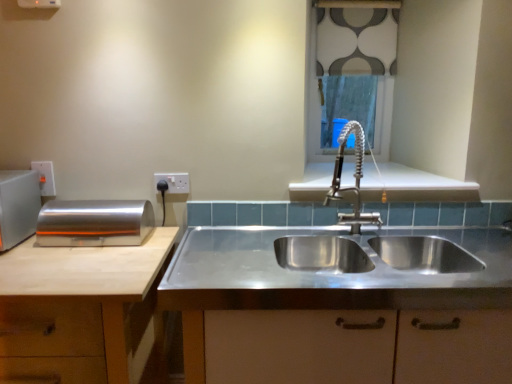
Question: From the image's perspective, is patterned fabric at upper center under stainless steel sink at center?

Choices:
 (A) no
 (B) yes

Answer: (A)

Question: Does patterned fabric at upper center come in front of stainless steel sink at center?

Choices:
 (A) no
 (B) yes

Answer: (A)

Question: Is patterned fabric at upper center bigger than stainless steel sink at center?

Choices:
 (A) no
 (B) yes

Answer: (A)

Question: Considering the relative sizes of patterned fabric at upper center and stainless steel sink at center in the image provided, is patterned fabric at upper center taller than stainless steel sink at center?

Choices:
 (A) no
 (B) yes

Answer: (B)

Question: Does patterned fabric at upper center have a lesser width compared to stainless steel sink at center?

Choices:
 (A) no
 (B) yes

Answer: (B)

Question: From the image's perspective, is stainless steel sink at center located above or below silver metallic breadbox at left, acting as the second appliance starting from the left?

Choices:
 (A) above
 (B) below

Answer: (B)

Question: Is stainless steel sink at center wider or thinner than silver metallic breadbox at left, marked as the first appliance in a right-to-left arrangement?

Choices:
 (A) wide
 (B) thin

Answer: (A)

Question: From a real-world perspective, is stainless steel sink at center physically located above or below silver metallic breadbox at left, marked as the first appliance in a right-to-left arrangement?

Choices:
 (A) below
 (B) above

Answer: (A)

Question: Based on their positions, is stainless steel sink at center located to the left or right of silver metallic breadbox at left, acting as the second appliance starting from the left?

Choices:
 (A) left
 (B) right

Answer: (B)

Question: Relative to patterned fabric at upper center, is satin silver toaster at left, acting as the 2th appliance starting from the right, in front or behind?

Choices:
 (A) front
 (B) behind

Answer: (A)

Question: Choose the correct answer: Is satin silver toaster at left, which appears as the first appliance when viewed from the left, inside patterned fabric at upper center or outside it?

Choices:
 (A) inside
 (B) outside

Answer: (B)

Question: From the image's perspective, is satin silver toaster at left, which appears as the first appliance when viewed from the left, above or below patterned fabric at upper center?

Choices:
 (A) above
 (B) below

Answer: (B)

Question: From a real-world perspective, relative to patterned fabric at upper center, is satin silver toaster at left, acting as the 2th appliance starting from the right, vertically above or below?

Choices:
 (A) above
 (B) below

Answer: (B)

Question: Is patterned fabric at upper center in front of or behind white plastic electric outlet at upper left, the second electric outlet from the right, in the image?

Choices:
 (A) front
 (B) behind

Answer: (B)

Question: From their relative heights in the image, would you say patterned fabric at upper center is taller or shorter than white plastic electric outlet at upper left, the second electric outlet from the right?

Choices:
 (A) short
 (B) tall

Answer: (B)